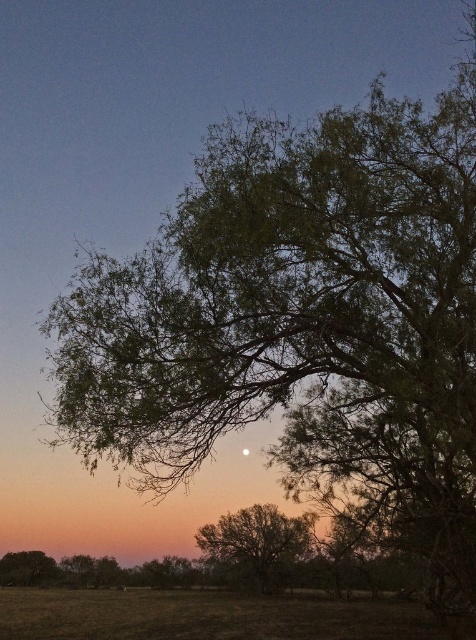
You are an astronomer observing the night sky. You notice the green grassy field at lower center and the bright silver moon at upper center. Which object is located higher in the sky?

The bright silver moon at upper center is higher in the sky than the green grassy field at lower center.

You are an astronomer observing the night sky through a telescope. You notice the green leafy tree at lower left and the bright silver moon at upper center. Which object is closer to your telescope?

The green leafy tree at lower left is closer to the telescope because it is positioned further to the viewer than the bright silver moon at upper center, meaning it is nearer in the line of sight.

You are standing at the point with coordinates (210,616) in this sunset scene. What do you see directly beneath your feet?

At point (210,616) lies green grassy field at lower center, so you see the green grassy field at lower center directly beneath your feet.